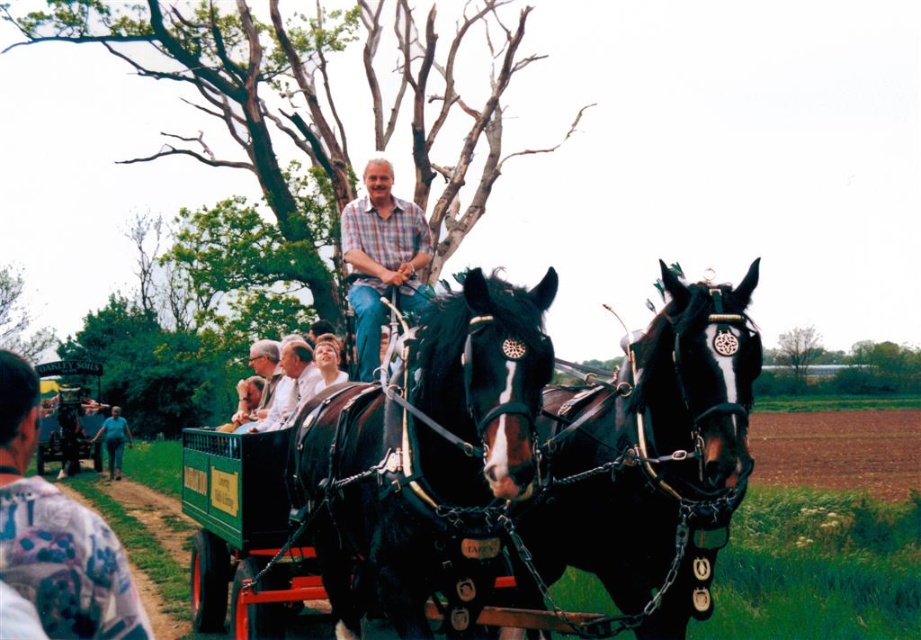
Question: Is black leather harness at center positioned behind green wooden cart at center?

Choices:
 (A) yes
 (B) no

Answer: (B)

Question: Is black leather harness at center positioned in front of plaid shirt at center?

Choices:
 (A) no
 (B) yes

Answer: (B)

Question: Which object is closer to the camera taking this photo?

Choices:
 (A) light blue shirt at lower left
 (B) shiny black horse at center
 (C) plaid shirt at center

Answer: (A)

Question: Among these objects, which one is farthest from the camera?

Choices:
 (A) blue jeans at lower left
 (B) plaid shirt at center

Answer: (A)

Question: From the image, what is the correct spatial relationship of shiny black horse at center in relation to blue jeans at lower left?

Choices:
 (A) above
 (B) below

Answer: (A)

Question: Based on their relative distances, which object is farther from the plaid shirt at center?

Choices:
 (A) black leather harness at center
 (B) shiny black horse at center

Answer: (A)